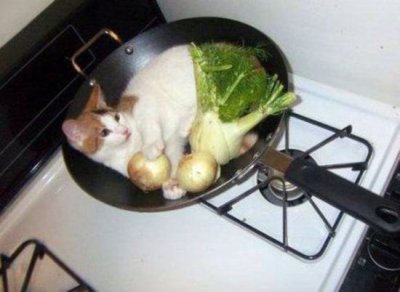
This screenshot has height=292, width=400. What are the coordinates of `wok pan` in the screenshot? It's located at (221, 37).